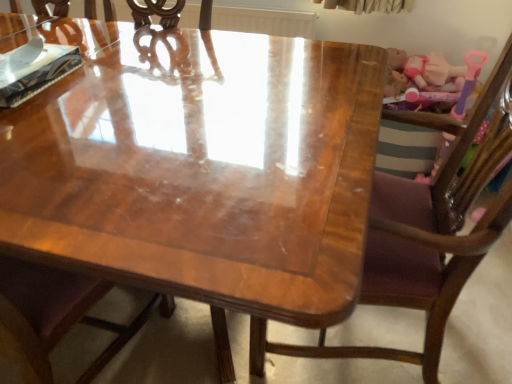
Describe the element at coordinates (424, 236) in the screenshot. I see `wooden chair at right` at that location.

This screenshot has width=512, height=384. In order to click on wooden chair at right in this screenshot , I will do `click(424, 236)`.

Find the location of `wooden chair at right`. wooden chair at right is located at coordinates (424, 236).